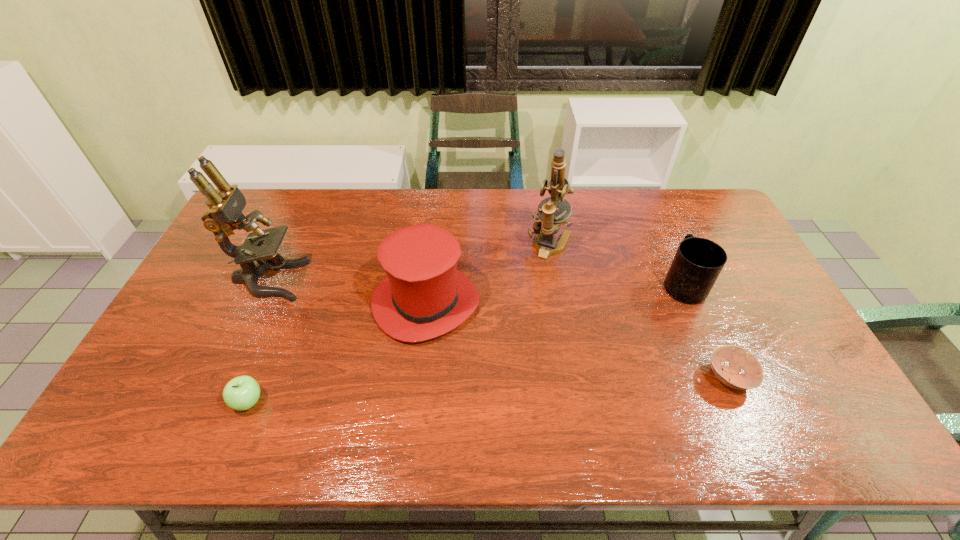
Locate an element on the screen. This screenshot has height=540, width=960. vacant point located 0.170m on the side of the mug with the handle is located at coordinates (660, 231).

I want to click on vacant space situated 0.270m on the side of the mug with the handle, so click(652, 213).

The height and width of the screenshot is (540, 960). I want to click on vacant area located 0.220m on the side of the mug with the handle, so click(656, 221).

This screenshot has height=540, width=960. What are the coordinates of `vacant space located 0.310m on the back of the second shortest object` in the screenshot? It's located at (291, 294).

Locate an element on the screen. vacant space located 0.110m on the right of the shortest object is located at coordinates (796, 377).

The width and height of the screenshot is (960, 540). Identify the location of object at the far edge. (546, 224).

You are a GUI agent. You are given a task and a screenshot of the screen. Output one action in this format:
    pyautogui.click(x=<x>, y=<y>)
    Task: Click on the object that is at the near edge
    This screenshot has height=540, width=960.
    Given the screenshot: What is the action you would take?
    pyautogui.click(x=241, y=393)

The width and height of the screenshot is (960, 540). I want to click on object located at the left edge, so click(224, 215).

In the image, there is a desktop. Identify the location of free space at the far edge. The width and height of the screenshot is (960, 540). (613, 210).

This screenshot has height=540, width=960. I want to click on vacant point at the near edge, so click(536, 418).